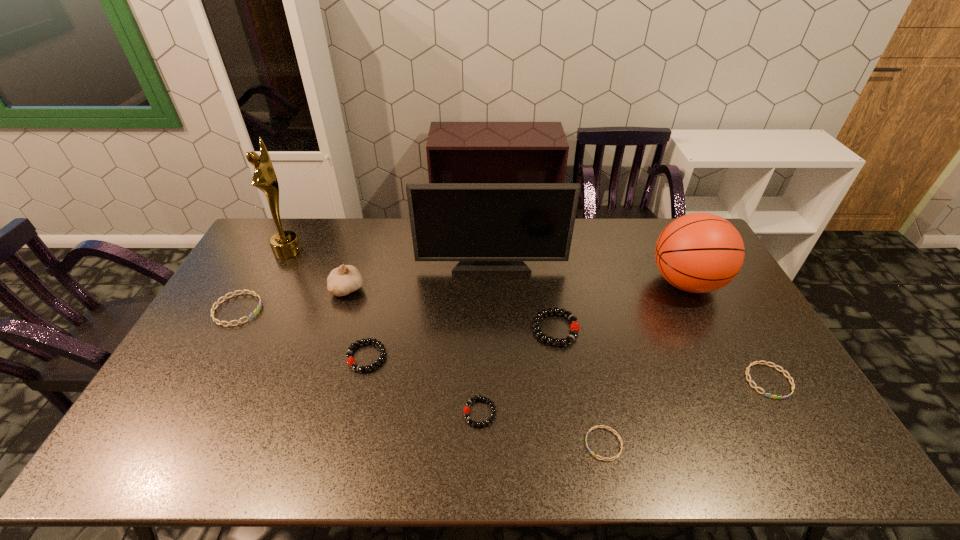
Find the location of a particular element. Image resolution: width=960 pixels, height=540 pixels. the leftmost black bracelet is located at coordinates [x=350, y=360].

You are a GUI agent. You are given a task and a screenshot of the screen. Output one action in this format:
    pyautogui.click(x=<x>, y=<y>)
    Task: Click on the fourth object from left to right
    This screenshot has width=960, height=540.
    Given the screenshot: What is the action you would take?
    pyautogui.click(x=350, y=360)

This screenshot has height=540, width=960. I want to click on the second nearest blue bracelet, so click(750, 381).

Identify the location of the second biggest blue bracelet. (750, 381).

Identify the location of the second black bracelet from left to right. (466, 409).

In order to click on the nearest black bracelet in this screenshot , I will do `click(466, 409)`.

Find the location of a particular element. The height and width of the screenshot is (540, 960). the nearest blue bracelet is located at coordinates (615, 457).

You are a GUI agent. You are given a task and a screenshot of the screen. Output one action in this format:
    pyautogui.click(x=<x>, y=<y>)
    Task: Click on the shortest bracelet
    This screenshot has width=960, height=540.
    Given the screenshot: What is the action you would take?
    pyautogui.click(x=615, y=457)

You are a GUI agent. You are given a task and a screenshot of the screen. Output one action in this format:
    pyautogui.click(x=<x>, y=<y>)
    Task: Click on the vacant space located 0.380m on the front-facing side of the tallest object
    The width and height of the screenshot is (960, 540).
    Given the screenshot: What is the action you would take?
    (404, 251)

This screenshot has width=960, height=540. In order to click on vacant space located on the screen side of the black monitor in this screenshot , I will do `click(492, 288)`.